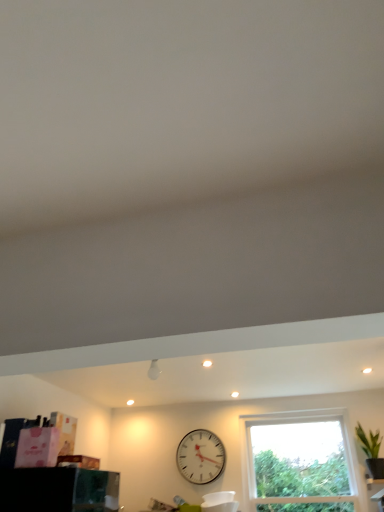
Question: Looking at the image, does matte white cabinet at lower right seem bigger or smaller compared to green leafy plant at right?

Choices:
 (A) big
 (B) small

Answer: (B)

Question: Based on their positions, is matte white cabinet at lower right located to the left or right of green leafy plant at right?

Choices:
 (A) right
 (B) left

Answer: (A)

Question: Based on their relative distances, which object is farther from the transparent glass window at center?

Choices:
 (A) matte white cabinet at lower right
 (B) green leafy plant at right
 (C) white plastic wall clock at center

Answer: (A)

Question: Which of these objects is positioned farthest from the green leafy plant at right?

Choices:
 (A) matte white cabinet at lower right
 (B) white plastic wall clock at center
 (C) transparent glass window at center

Answer: (B)